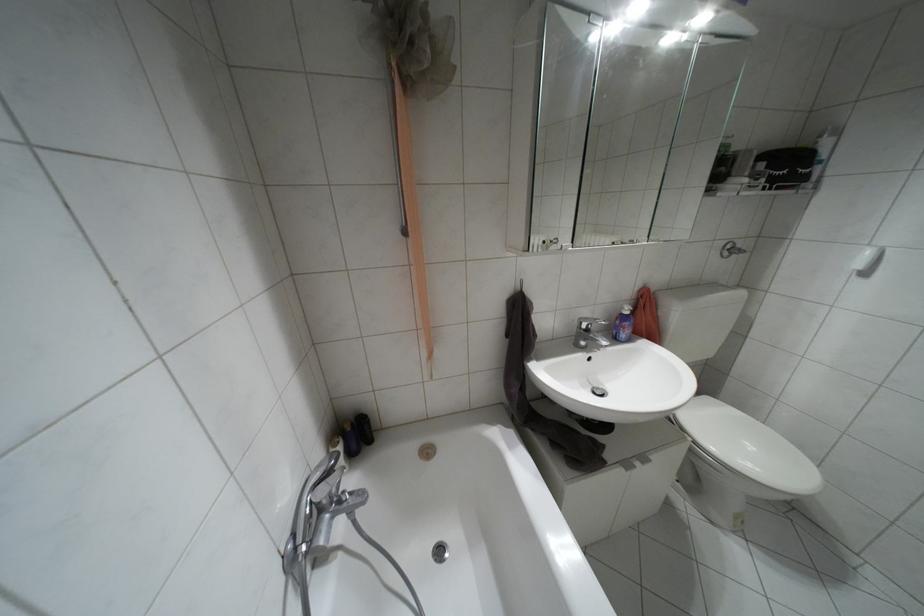
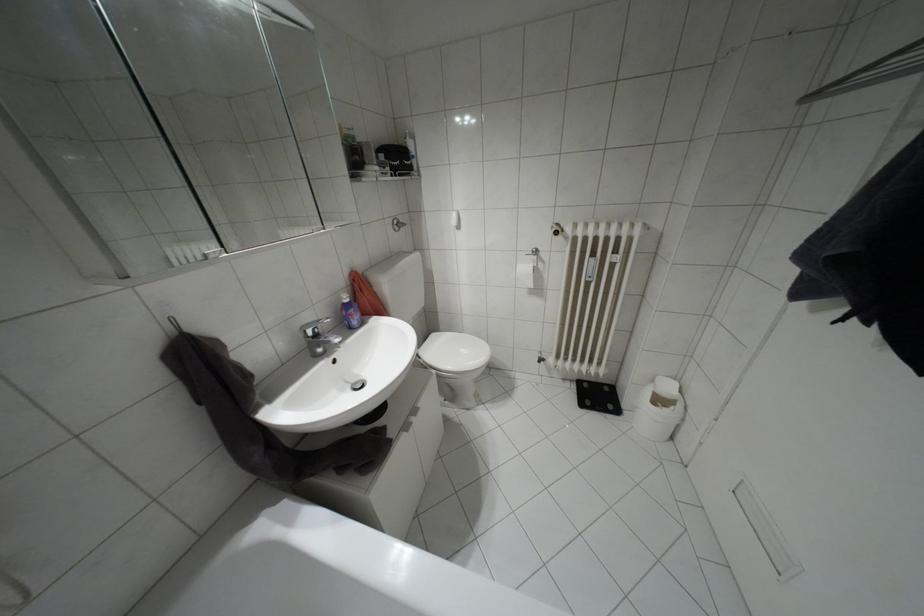
Question: The camera is either moving clockwise (left) or counter-clockwise (right) around the object. The first image is from the beginning of the video and the second image is from the end. Is the camera moving left or right when shooting the video?

Choices:
 (A) Left
 (B) Right

Answer: (A)